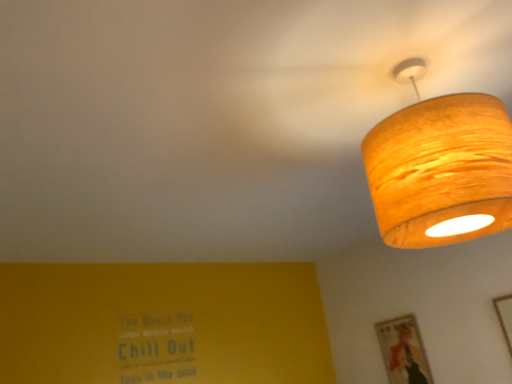
Question: In terms of height, does wooden picture frame at upper right, the first picture frame viewed from the right, look taller or shorter compared to wooden textured picture frame at lower right, placed as the 1th picture frame when sorted from left to right?

Choices:
 (A) tall
 (B) short

Answer: (A)

Question: Looking at their shapes, would you say wooden picture frame at upper right, arranged as the 2th picture frame when viewed from the left, is wider or thinner than wooden textured picture frame at lower right, the second picture frame from the right?

Choices:
 (A) wide
 (B) thin

Answer: (B)

Question: Considering the real-world distances, which object is farthest from the wooden textured lampshade at upper right?

Choices:
 (A) wooden picture frame at upper right, the first picture frame viewed from the right
 (B) wooden textured picture frame at lower right, placed as the 1th picture frame when sorted from left to right

Answer: (B)

Question: Based on their relative distances, which object is nearer to the wooden picture frame at upper right, arranged as the 2th picture frame when viewed from the left?

Choices:
 (A) wooden textured picture frame at lower right, marked as the first picture frame in a back-to-front arrangement
 (B) wooden textured lampshade at upper right

Answer: (A)